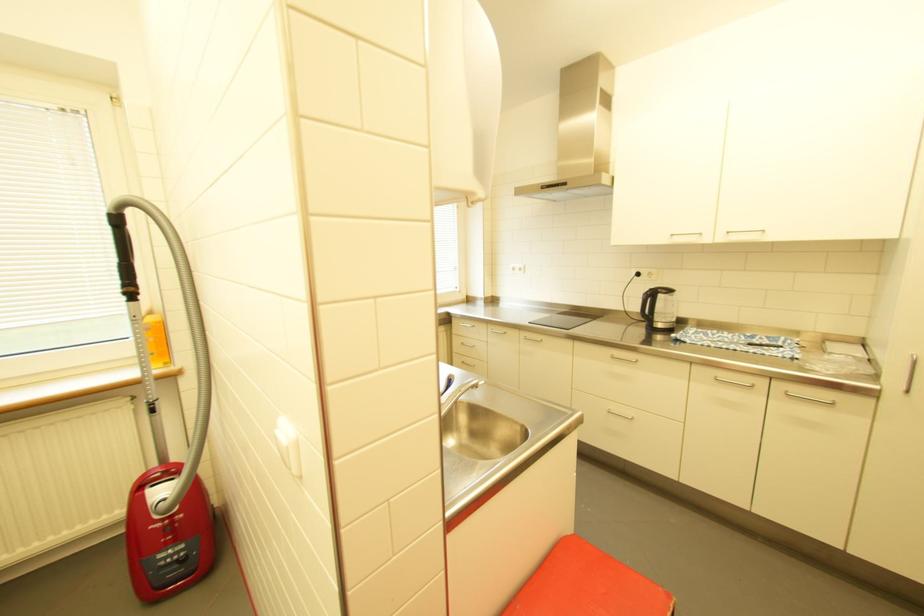
I want to click on white light switch, so click(x=283, y=447).